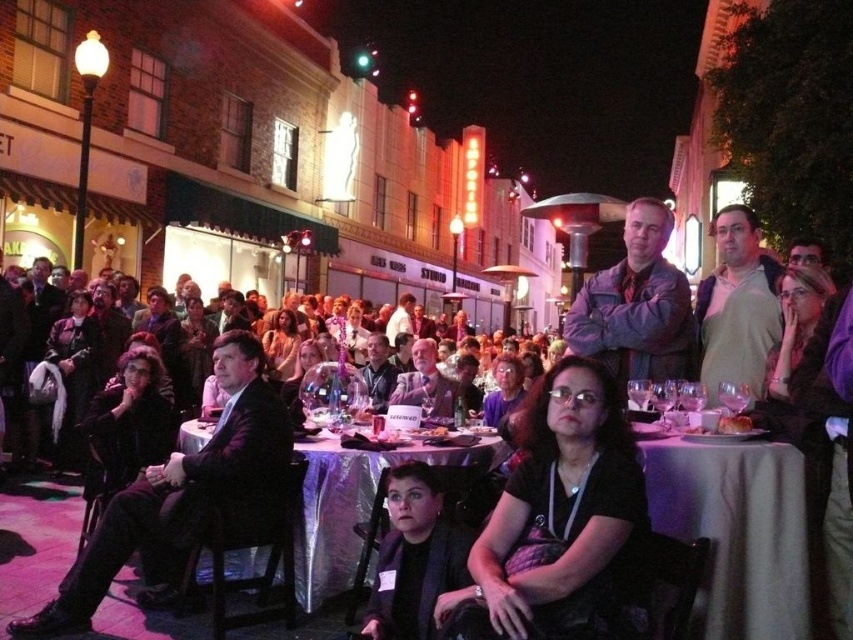
Between black suit at left and silver metallic table at center, which one has more height?

With more height is black suit at left.

Between black suit at left and silver metallic table at center, which one is positioned lower?

silver metallic table at center is lower down.

Who is more distant from viewer, (86, 572) or (367, 484)?

The point (367, 484) is more distant.

Locate an element on the screen. black suit at left is located at coordinates (184, 497).

Between light brown sweater at center and dark gray suit at center, which one has less height?

With less height is light brown sweater at center.

At what (x,y) coordinates should I click in order to perform the action: click on light brown sweater at center. Please return your answer as a coordinate pair (x, y). The image size is (853, 640). Looking at the image, I should click on (737, 307).

Who is lower down, dark gray shirt at center or dark gray suit at center?

dark gray shirt at center

Locate an element on the screen. This screenshot has width=853, height=640. dark gray shirt at center is located at coordinates (415, 557).